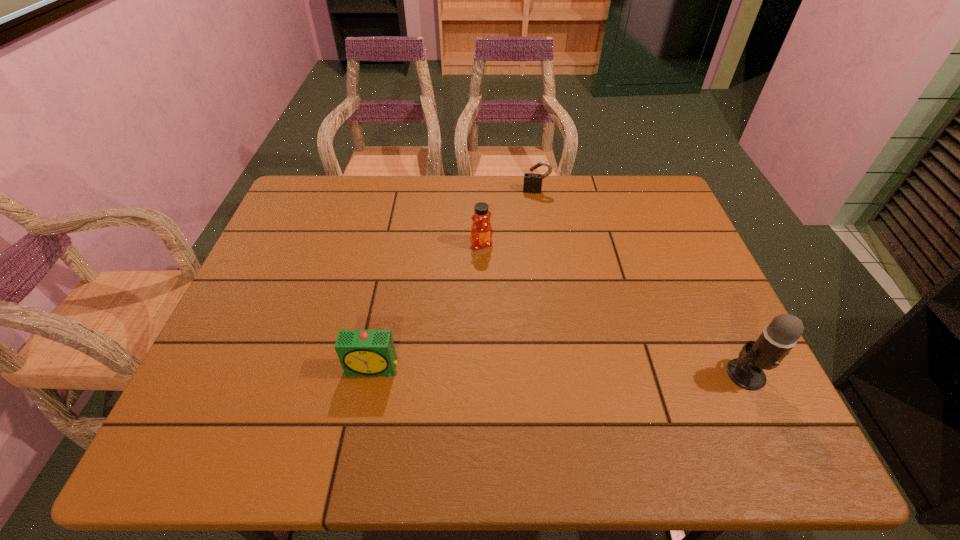
Find the location of a particular element. unoccupied area between the rightmost object and the third nearest object is located at coordinates (614, 309).

Find the location of `free point between the third nearest object and the leftmost object`. free point between the third nearest object and the leftmost object is located at coordinates (427, 306).

This screenshot has width=960, height=540. Find the location of `free space between the leftmost object and the third object from left to right`. free space between the leftmost object and the third object from left to right is located at coordinates pyautogui.click(x=454, y=280).

Identify the location of empty space that is in between the farthest object and the second tallest object. The height and width of the screenshot is (540, 960). (509, 218).

Identify which object is the nearest to the rightmost object. Please provide its 2D coordinates. Your answer should be formatted as a tuple, i.e. [(x, y)], where the tuple contains the x and y coordinates of a point satisfying the conditions above.

[(481, 231)]

In order to click on the third closest object relative to the leftmost object in this screenshot , I will do `click(778, 338)`.

You are a GUI agent. You are given a task and a screenshot of the screen. Output one action in this format:
    pyautogui.click(x=<x>, y=<y>)
    Task: Click on the free space that satisfies the following two spatial constraints: 1. on the front side of the second object from left to right; 2. on the right side of the tallest object
    The width and height of the screenshot is (960, 540).
    Given the screenshot: What is the action you would take?
    pyautogui.click(x=482, y=374)